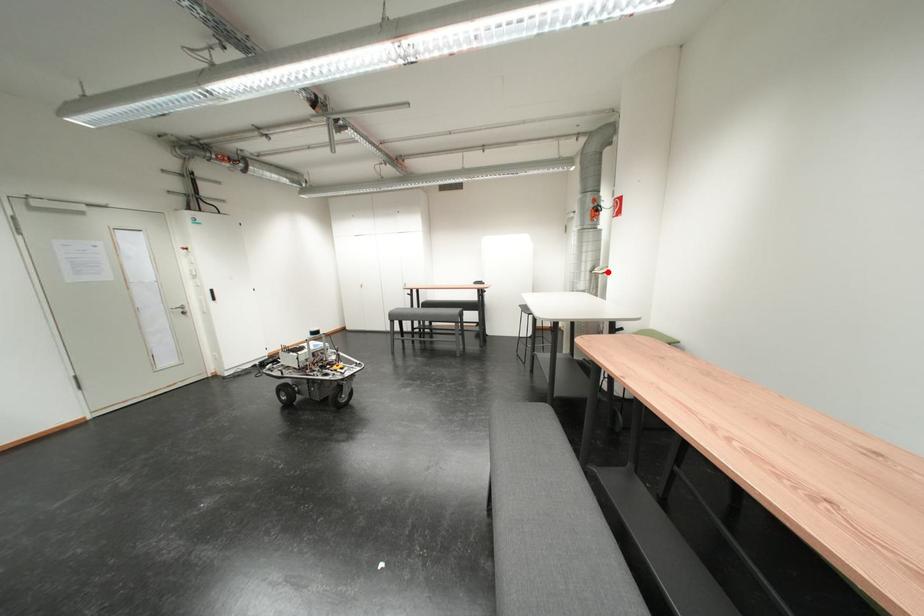
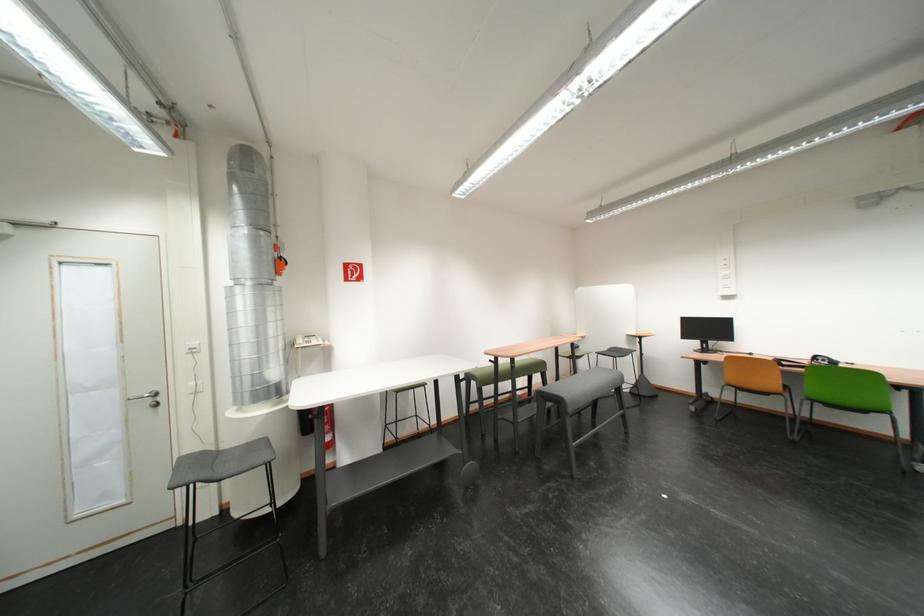
Where in the second image is the point corresponding to the highlighted location from the first image?

(311, 345)